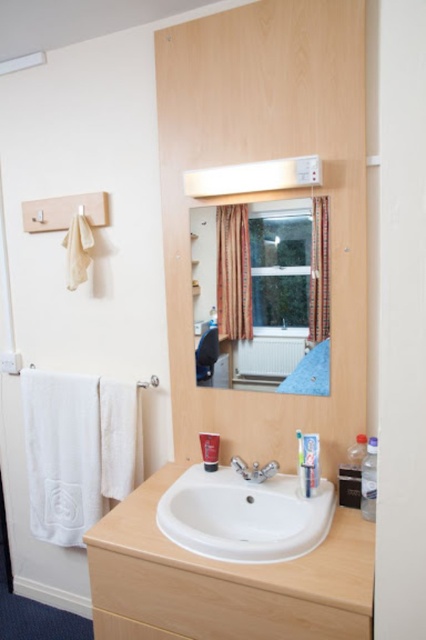
Is white matte sink at center to the right of brown textured curtain at center from the viewer's perspective?

Yes, white matte sink at center is to the right of brown textured curtain at center.

Is white matte sink at center in front of brown textured curtain at center?

Yes.

Does point (293, 632) come farther from viewer compared to point (230, 292)?

That is False.

Where is `white matte sink at center`? The image size is (426, 640). white matte sink at center is located at coordinates (224, 580).

Does brown textured curtain at center appear on the right side of silver metallic faucet at center?

No, brown textured curtain at center is not to the right of silver metallic faucet at center.

Is point (238, 227) more distant than point (247, 472)?

No.

Find the location of `brown textured curtain at center`. brown textured curtain at center is located at coordinates (233, 273).

Is clear glass window at center further to the viewer compared to silver metallic faucet at center?

No, it is not.

Which of these two, clear glass window at center or silver metallic faucet at center, stands taller?

clear glass window at center

You are a GUI agent. You are given a task and a screenshot of the screen. Output one action in this format:
    pyautogui.click(x=<x>, y=<y>)
    Task: Click on the clear glass window at center
    The image size is (426, 640).
    Given the screenshot: What is the action you would take?
    pyautogui.click(x=279, y=268)

Image resolution: width=426 pixels, height=640 pixels. I want to click on clear glass window at center, so click(x=279, y=268).